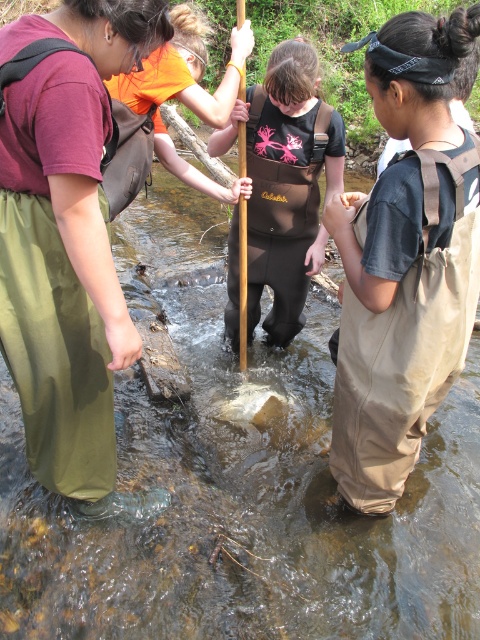
Question: Does green fabric pants at left have a smaller size compared to tan waterproof waders at center?

Choices:
 (A) no
 (B) yes

Answer: (A)

Question: Is tan waterproof waders at center below brown fabric waders at center?

Choices:
 (A) no
 (B) yes

Answer: (B)

Question: Is tan waterproof waders at center positioned at the back of brown fabric waders at center?

Choices:
 (A) yes
 (B) no

Answer: (B)

Question: Which object is closer to the camera taking this photo?

Choices:
 (A) wooden paddle at center
 (B) green fabric pants at left

Answer: (B)

Question: Which of the following is the farthest from the observer?

Choices:
 (A) wooden paddle at center
 (B) green fabric pants at left
 (C) brown fabric waders at center

Answer: (C)

Question: Which is farther from the wooden paddle at center?

Choices:
 (A) brown fabric waders at center
 (B) green fabric pants at left
 (C) tan waterproof waders at center

Answer: (B)